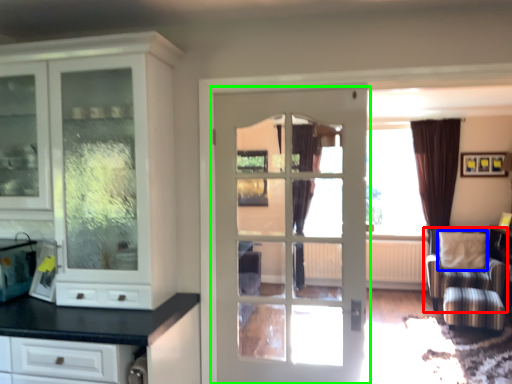
Question: Which object is positioned farthest from chair (highlighted by a red box)? Select from pillow (highlighted by a blue box) and door (highlighted by a green box).

Choices:
 (A) pillow
 (B) door

Answer: (B)